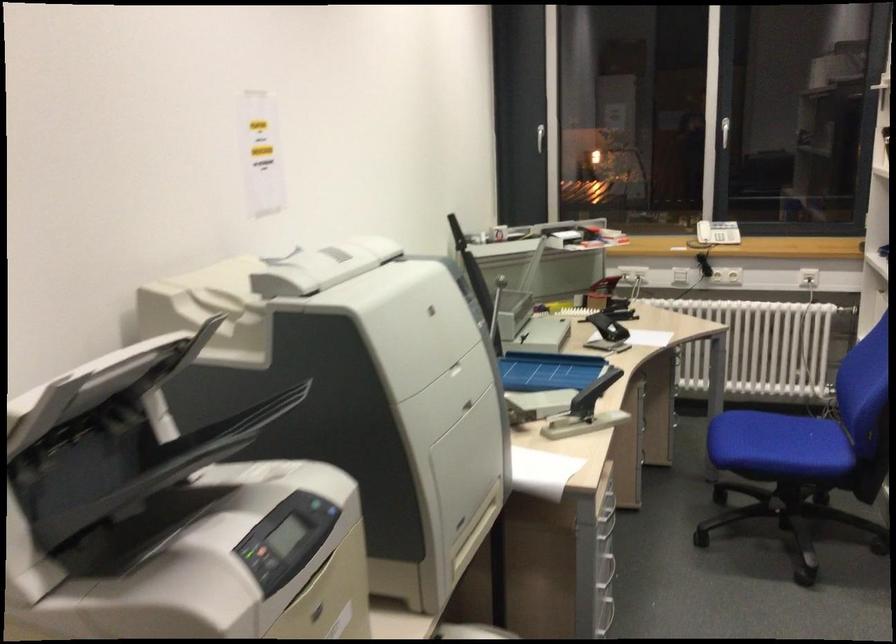
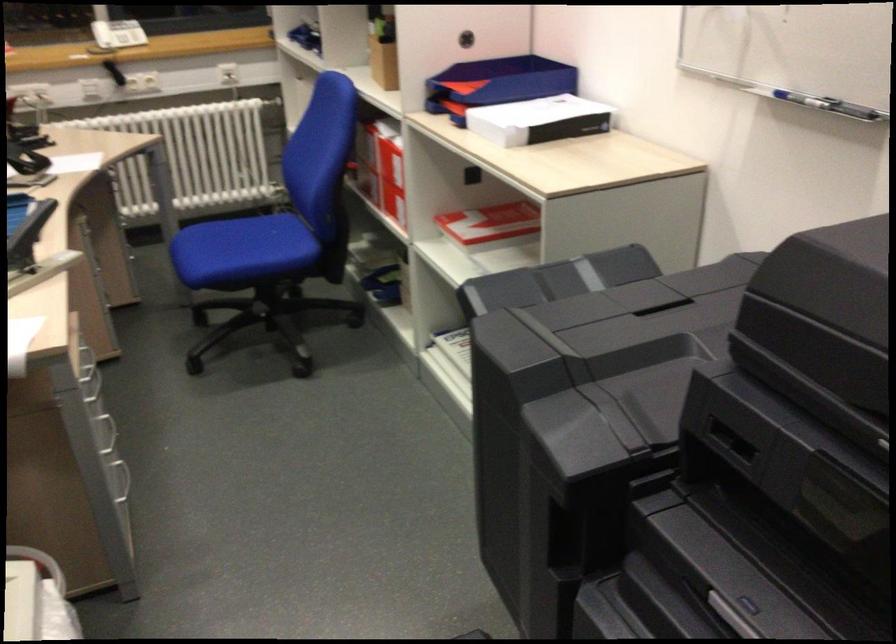
Find the pixel in the second image that matches (x=602, y=523) in the first image.

(92, 386)